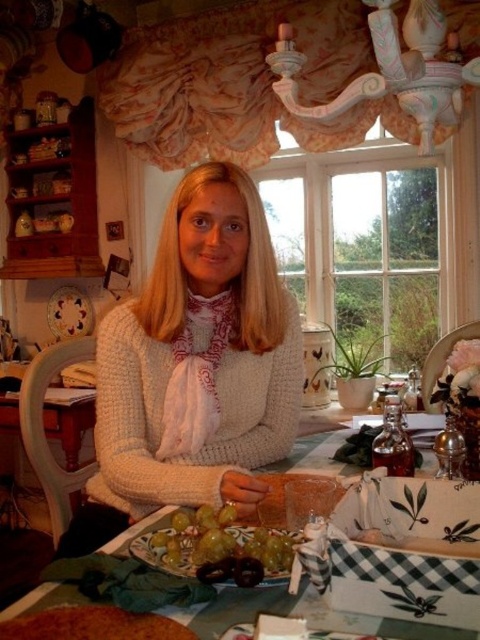
You are a guest at this table and want to place the green matte grapes at lower center onto the green matte plate at lower center. Based on their sizes, will the grapes fit entirely on the plate?

The green matte plate at lower center is bigger than the green matte grapes at lower center, so yes, the grapes will fit entirely on the plate.

What object is located at the coordinates point (300, 616) in the image?

The point (300, 616) indicates the green matte plate at lower center.